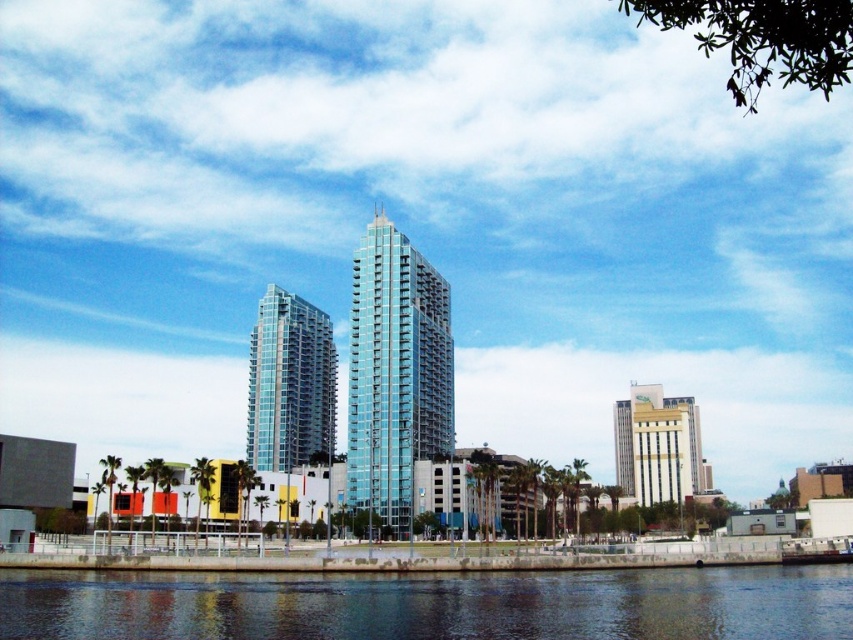
Question: Which point is farther to the camera?

Choices:
 (A) (369, 352)
 (B) (666, 493)
 (C) (643, 568)
 (D) (271, 355)

Answer: (B)

Question: Is dark blue water at lower center thinner than transparent glass building at center?

Choices:
 (A) yes
 (B) no

Answer: (B)

Question: Which object appears farthest from the camera in this image?

Choices:
 (A) transparent glass building at center
 (B) gold/golden metallic building at center-right

Answer: (B)

Question: Is shiny glass skyscraper at center wider than gold/golden metallic building at center-right?

Choices:
 (A) no
 (B) yes

Answer: (A)

Question: Does transparent glass building at center have a larger size compared to shiny glass skyscraper at center?

Choices:
 (A) yes
 (B) no

Answer: (B)

Question: Which point is farther from the camera taking this photo?

Choices:
 (A) (262, 440)
 (B) (663, 426)
 (C) (721, 609)
 (D) (399, 525)

Answer: (B)